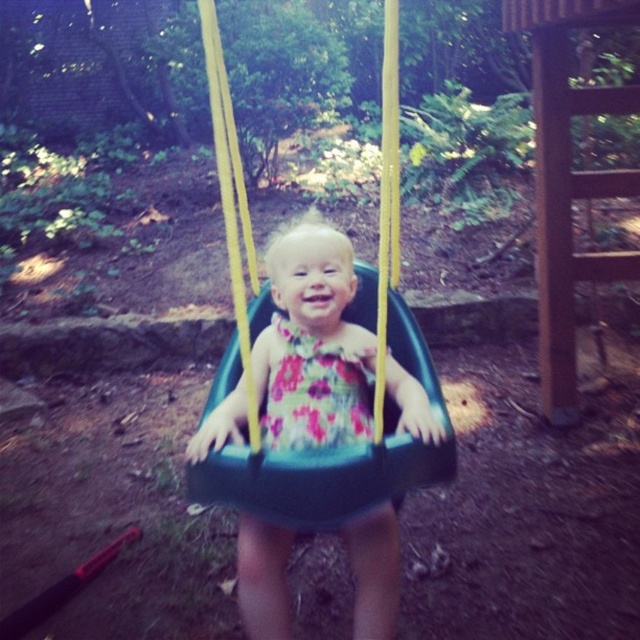
You are a photographer trying to capture the child in the floral dress at center and the black plastic swing at center. Since you want to focus on the child, which object should you zoom in on more?

The floral dress at center is bigger than the black plastic swing at center, so you should zoom in more on the floral dress at center to focus on the child.

You are a photographer trying to capture the child in the floral dress at center and the floral fabric dress at center. Since you want to focus on the smaller one, which dress should you zoom in on?

The floral fabric dress at center is smaller than the floral dress at center, so you should zoom in on the floral fabric dress at center.